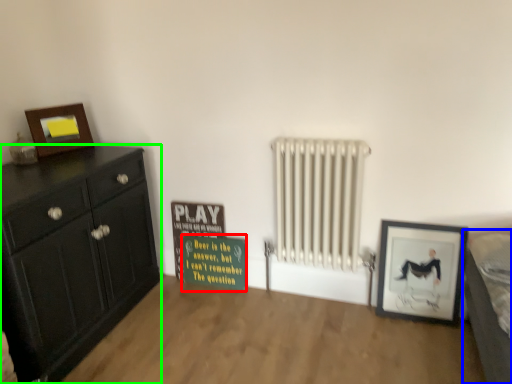
Question: Which object is positioned farthest from warning sign (highlighted by a red box)? Select from bed (highlighted by a blue box) and chest of drawers (highlighted by a green box).

Choices:
 (A) bed
 (B) chest of drawers

Answer: (A)